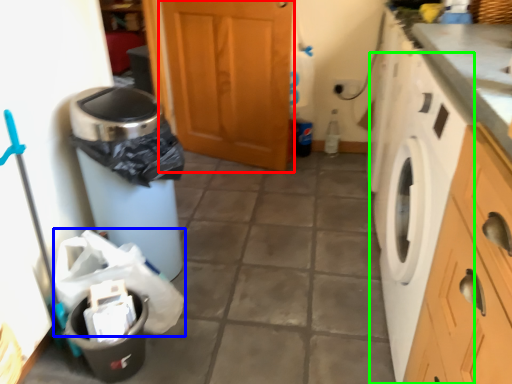
Question: Which is farther away from screen door (highlighted by a red box)? material (highlighted by a blue box) or washing machine (highlighted by a green box)?

Choices:
 (A) material
 (B) washing machine

Answer: (A)